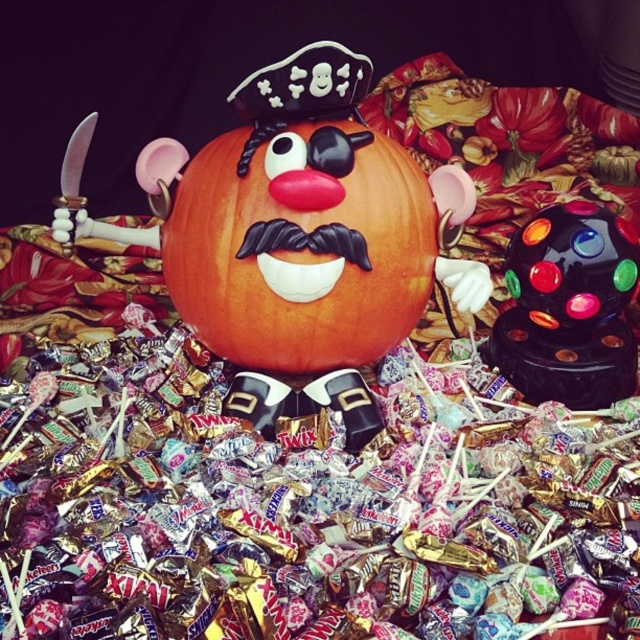
Question: Which object is closer to the camera taking this photo?

Choices:
 (A) shiny plastic ball at center
 (B) orange matte pumpkin at center

Answer: (B)

Question: Which of these objects is positioned farthest from the metallic foil wrapped candy at center?

Choices:
 (A) orange matte pumpkin at center
 (B) shiny plastic ball at center

Answer: (B)

Question: Does orange matte pumpkin at center have a smaller size compared to shiny plastic ball at center?

Choices:
 (A) no
 (B) yes

Answer: (B)

Question: Does metallic foil wrapped candy at center lie behind shiny plastic ball at center?

Choices:
 (A) yes
 (B) no

Answer: (B)

Question: Considering the real-world distances, which object is farthest from the orange matte pumpkin at center?

Choices:
 (A) shiny plastic ball at center
 (B) metallic foil wrapped candy at center

Answer: (A)

Question: Can you confirm if metallic foil wrapped candy at center is positioned to the left of shiny plastic ball at center?

Choices:
 (A) yes
 (B) no

Answer: (A)